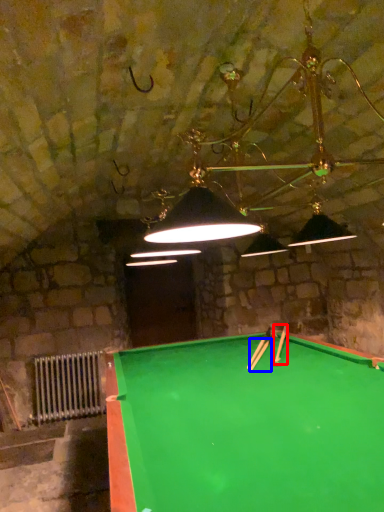
Question: Which object appears closest to the camera in this image, cue (highlighted by a red box) or cue (highlighted by a blue box)?

Choices:
 (A) cue
 (B) cue

Answer: (B)